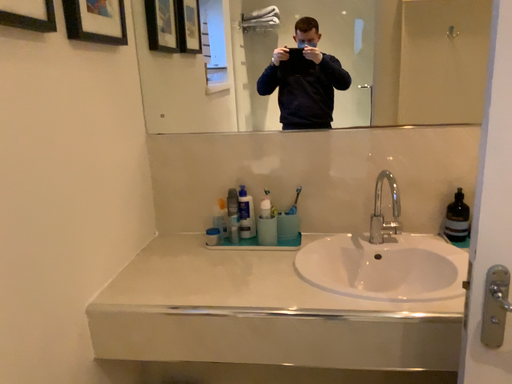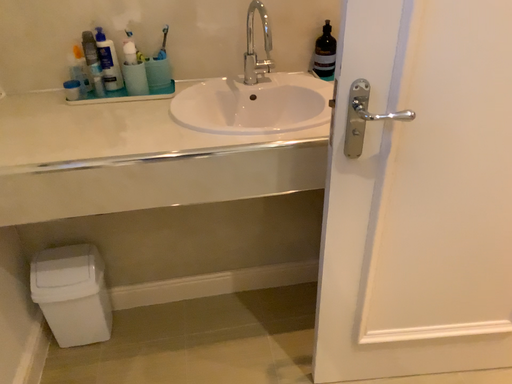
Question: Which way did the camera rotate in the video?

Choices:
 (A) rotated right
 (B) rotated left

Answer: (A)